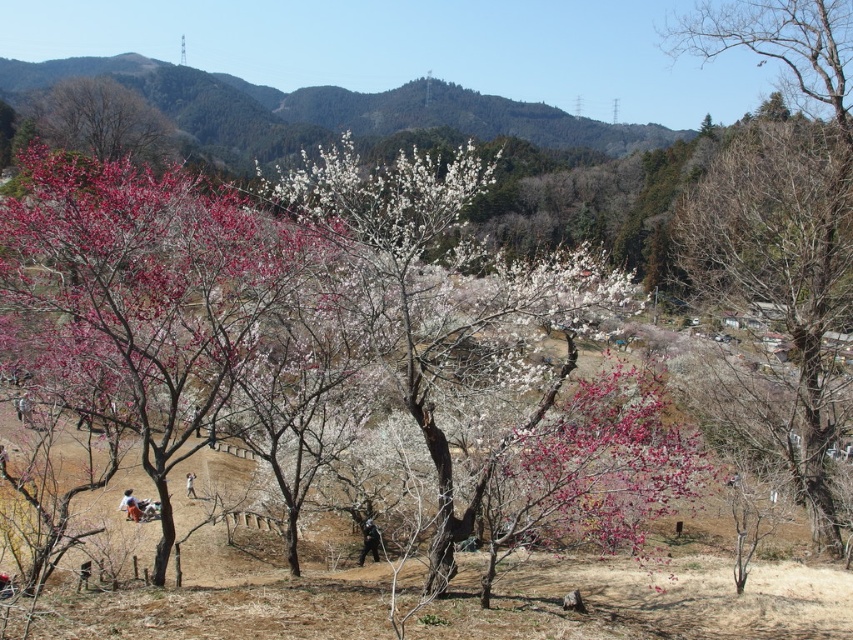
Is bare branches at right shorter than black fabric person at center?

In fact, bare branches at right may be taller than black fabric person at center.

Can you confirm if bare branches at right is positioned above black fabric person at center?

Correct, bare branches at right is located above black fabric person at center.

Between point (740, 35) and point (361, 552), which one is positioned in front?

Point (361, 552)

This screenshot has width=853, height=640. Identify the location of bare branches at right. (782, 204).

Can you confirm if bare branches at right is taller than bare branches at upper left?

Indeed, bare branches at right has a greater height compared to bare branches at upper left.

Between bare branches at right and bare branches at upper left, which one has less height?

Standing shorter between the two is bare branches at upper left.

What do you see at coordinates (782, 204) in the screenshot?
I see `bare branches at right` at bounding box center [782, 204].

The image size is (853, 640). I want to click on bare branches at right, so 782,204.

Is bare branches at right further to the viewer compared to white cotton shirt at lower center?

That is False.

Can you confirm if bare branches at right is taller than white cotton shirt at lower center?

Correct, bare branches at right is much taller as white cotton shirt at lower center.

Between point (744, 220) and point (194, 476), which one is positioned in front?

Point (744, 220) is more forward.

At what (x,y) coordinates should I click in order to perform the action: click on bare branches at right. Please return your answer as a coordinate pair (x, y). Image resolution: width=853 pixels, height=640 pixels. Looking at the image, I should click on (782, 204).